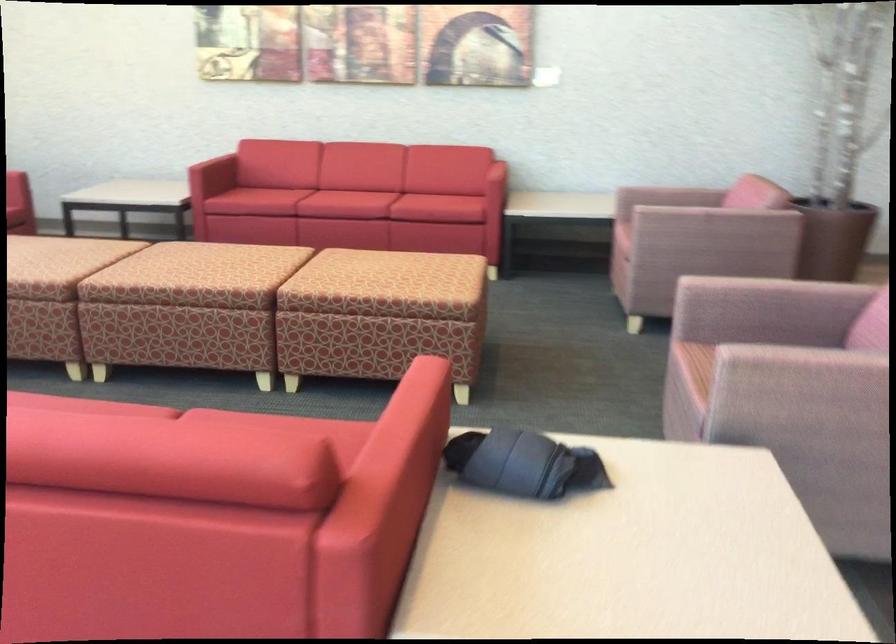
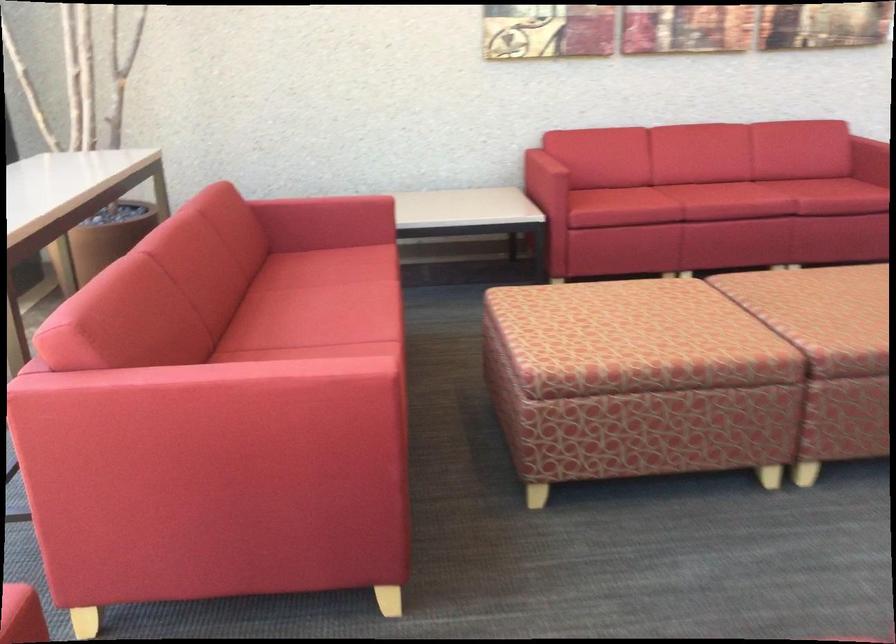
Locate, in the second image, the point that corresponds to point 325,187 in the first image.

(725, 201)